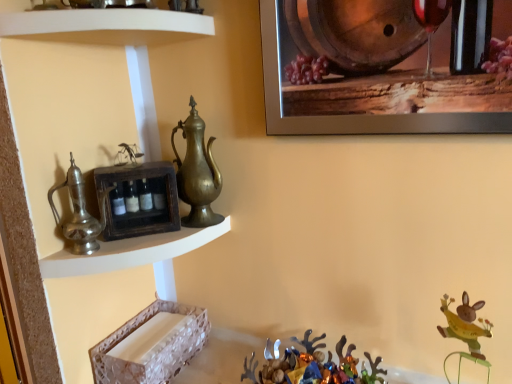
This screenshot has height=384, width=512. What are the coordinates of `free spot above metallic silver frame at upper left, which is the third shelf from top to bottom (from a real-world perspective)` in the screenshot? It's located at (140, 240).